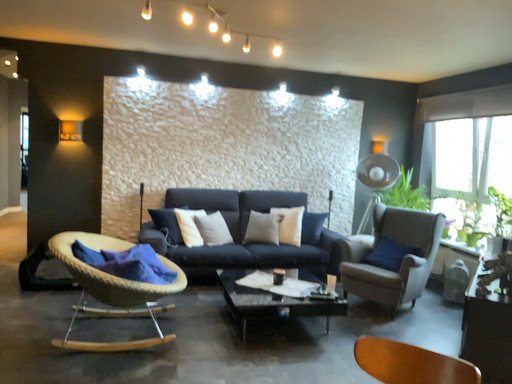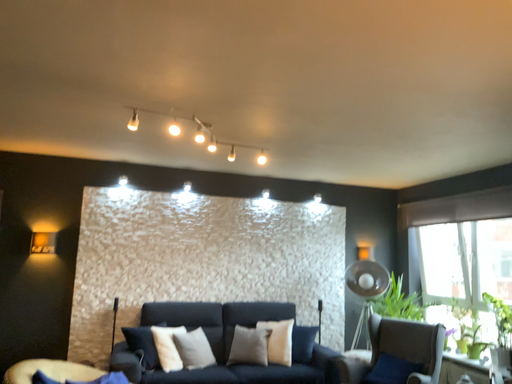
Question: How did the camera likely rotate when shooting the video?

Choices:
 (A) rotated upward
 (B) rotated downward

Answer: (A)